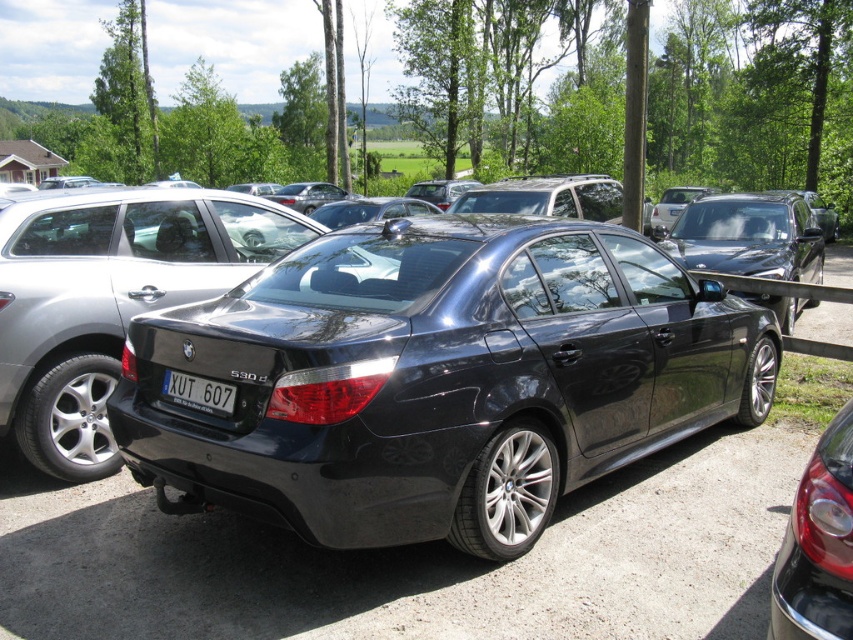
Question: Does glossy black sedan at center appear over white plastic license plate at rear?

Choices:
 (A) no
 (B) yes

Answer: (B)

Question: Which point is farther to the camera?

Choices:
 (A) (848, 492)
 (B) (682, 435)
 (C) (660, 230)

Answer: (C)

Question: Among these objects, which one is farthest from the camera?

Choices:
 (A) glossy metallic sedan at center
 (B) glossy black sedan at center
 (C) glossy black car at center

Answer: (B)

Question: Does glossy metallic sedan at center lie in front of white plastic license plate at rear?

Choices:
 (A) yes
 (B) no

Answer: (A)

Question: Which point appears farthest from the camera in this image?

Choices:
 (A) (827, 620)
 (B) (810, 253)
 (C) (212, 387)
 (D) (352, 538)

Answer: (B)

Question: Is glossy black car at center thinner than glossy black sedan at center?

Choices:
 (A) no
 (B) yes

Answer: (B)